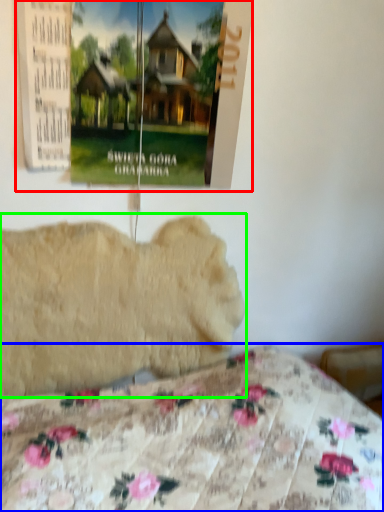
Question: Which is farther away from poster page (highlighted by a red box)? bed (highlighted by a blue box) or animal (highlighted by a green box)?

Choices:
 (A) bed
 (B) animal

Answer: (A)